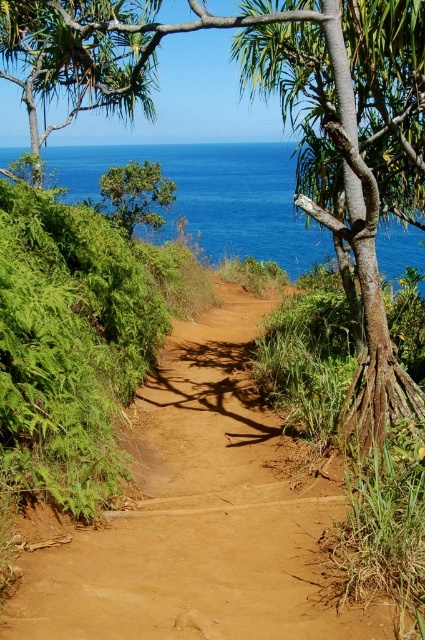
Is green leafy tree at center to the right of green leafy tree at upper left from the viewer's perspective?

Yes, green leafy tree at center is to the right of green leafy tree at upper left.

Consider the image. Can you confirm if green leafy tree at center is thinner than green leafy tree at upper left?

Yes, green leafy tree at center is thinner than green leafy tree at upper left.

Is point (379, 177) closer to viewer compared to point (135, 227)?

That is True.

Find the location of a particular element. Image resolution: width=425 pixels, height=640 pixels. green leafy tree at center is located at coordinates (283, 120).

Between point (244, 627) and point (121, 188), which one is positioned behind?

The point (121, 188) is more distant.

Which is in front, point (178, 624) or point (141, 202)?

Point (178, 624)

You are a GUI agent. You are given a task and a screenshot of the screen. Output one action in this format:
    pyautogui.click(x=<x>, y=<y>)
    Task: Click on the brown dirt track at center
    This screenshot has width=425, height=640.
    Given the screenshot: What is the action you would take?
    pyautogui.click(x=201, y=515)

Measure the distance between green leafy tree at center and camera.

They are 8.38 meters apart.

How much distance is there between green leafy tree at center and blue water at upper center?

green leafy tree at center is 23.59 feet from blue water at upper center.

Who is more distant from viewer, [142,33] or [210,257]?

The point [210,257] is behind.

Find the location of a particular element. Image resolution: width=425 pixels, height=640 pixels. green leafy tree at center is located at coordinates (283, 120).